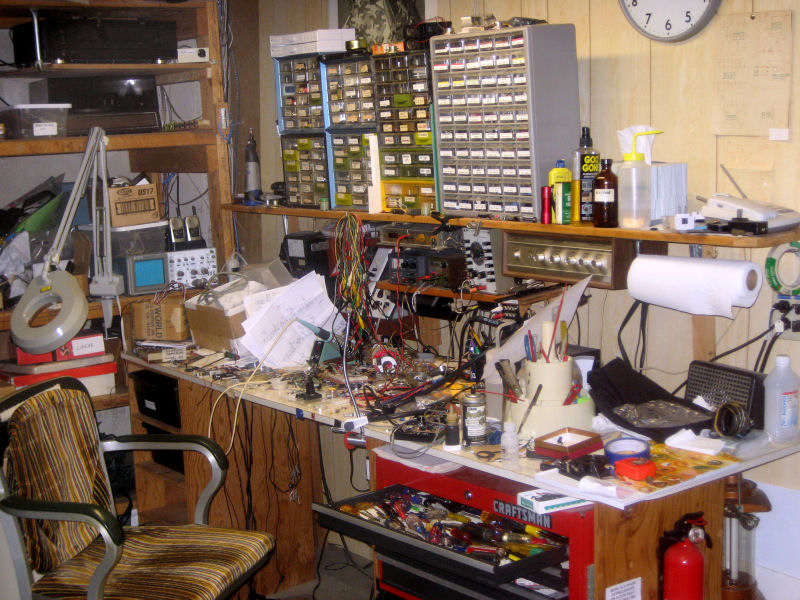
I want to click on floor, so click(342, 580), click(121, 506).